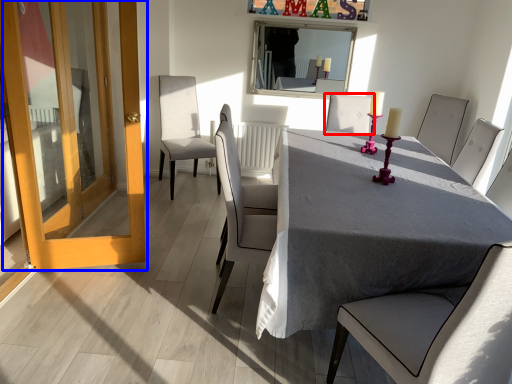
Question: Which object is further to the camera taking this photo, chair (highlighted by a red box) or door (highlighted by a blue box)?

Choices:
 (A) chair
 (B) door

Answer: (A)